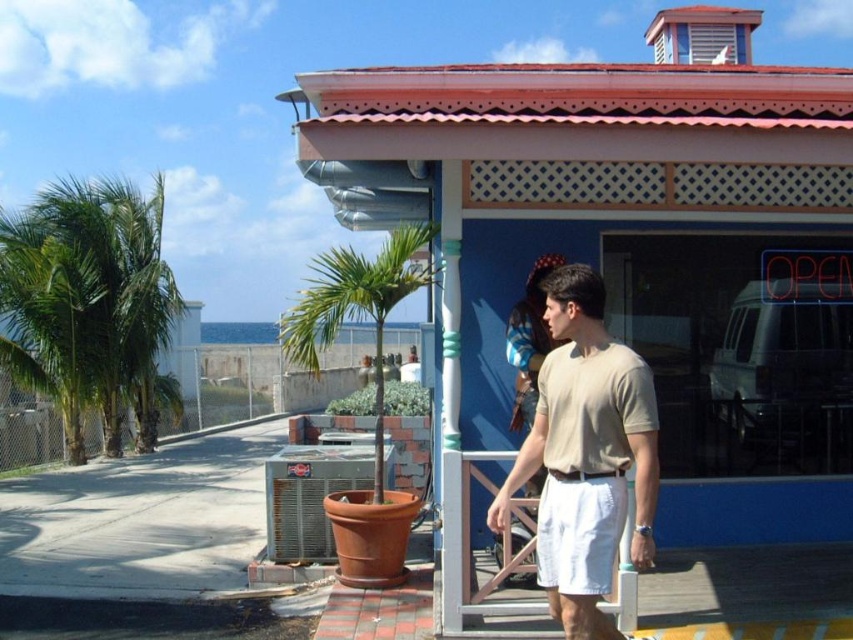
Does beige cotton t-shirt at center appear under white cotton shorts at center?

Actually, beige cotton t-shirt at center is above white cotton shorts at center.

Between beige cotton t-shirt at center and white cotton shorts at center, which one has more height?

Standing taller between the two is beige cotton t-shirt at center.

Which is behind, point (651, 557) or point (560, 497)?

The point (560, 497) is more distant.

This screenshot has width=853, height=640. In order to click on beige cotton t-shirt at center in this screenshot , I will do `click(585, 456)`.

Is green leafy palm tree at center positioned before white cotton shorts at center?

No, green leafy palm tree at center is behind white cotton shorts at center.

Does green leafy palm tree at center have a lesser width compared to white cotton shorts at center?

In fact, green leafy palm tree at center might be wider than white cotton shorts at center.

Does point (312, 324) come farther from viewer compared to point (550, 566)?

Yes.

The width and height of the screenshot is (853, 640). I want to click on green leafy palm tree at center, so click(x=357, y=308).

Which is below, green leafy palm trees at left or beige cotton t-shirt at center?

beige cotton t-shirt at center is below.

From the picture: Is green leafy palm trees at left positioned behind beige cotton t-shirt at center?

Yes.

Between point (61, 216) and point (608, 385), which one is positioned in front?

Point (608, 385) is in front.

Image resolution: width=853 pixels, height=640 pixels. Identify the location of green leafy palm trees at left. (88, 304).